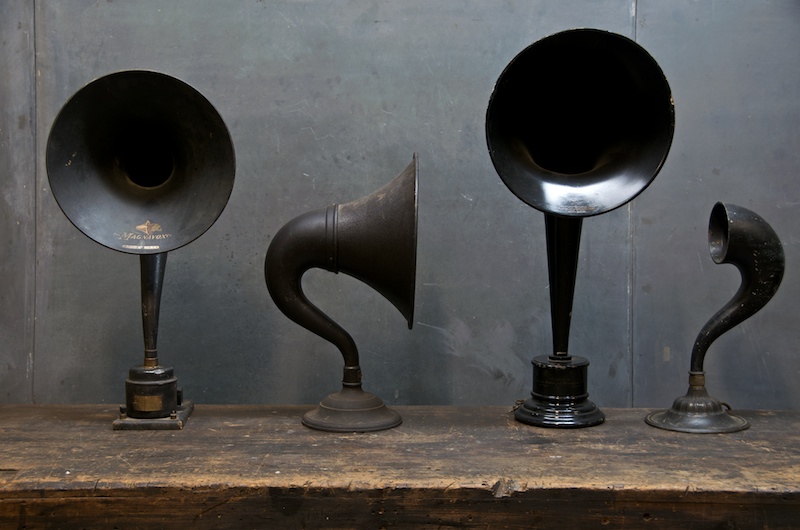
Image resolution: width=800 pixels, height=530 pixels. In order to click on area on rustic wood surface that's chipped in this screenshot , I will do `click(497, 492)`, `click(510, 485)`, `click(200, 488)`.